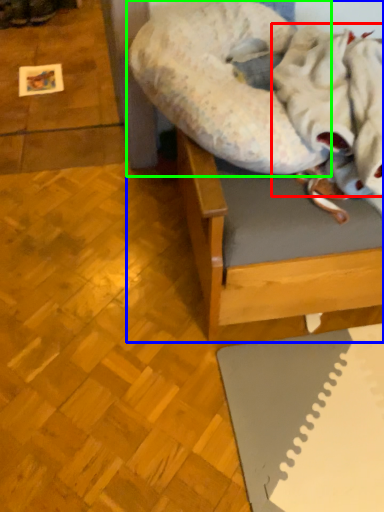
Question: Estimate the real-world distances between objects in this image. Which object is closer to blanket (highlighted by a red box), furniture (highlighted by a blue box) or dog bed (highlighted by a green box)?

Choices:
 (A) furniture
 (B) dog bed

Answer: (B)